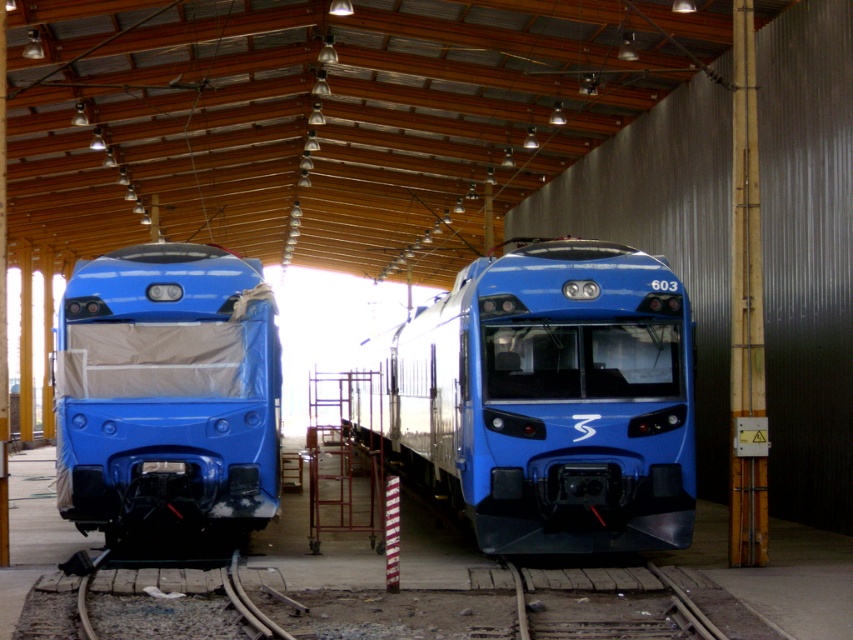
In the scene shown: Can you confirm if matte blue train at center is thinner than matte blue train at left?

No.

Between point (659, 493) and point (62, 307), which one is positioned in front?

Positioned in front is point (659, 493).

Is point (590, 394) more distant than point (199, 364)?

No, it is in front of (199, 364).

The width and height of the screenshot is (853, 640). In order to click on matte blue train at center in this screenshot , I will do `click(550, 397)`.